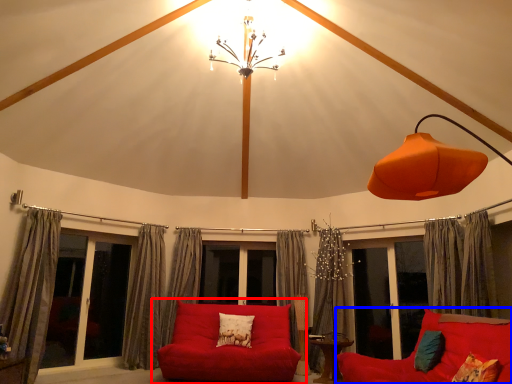
Question: Which of the following is the closest to the observer, studio couch (highlighted by a red box) or studio couch (highlighted by a blue box)?

Choices:
 (A) studio couch
 (B) studio couch

Answer: (B)